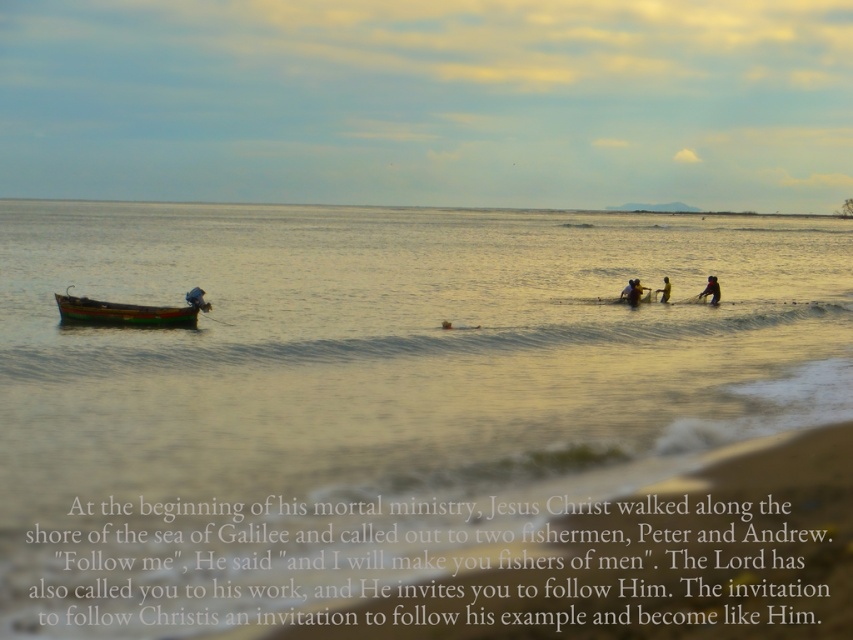
Question: Observing the image, what is the correct spatial positioning of dark blue fabric at lower right in reference to yellow fabric shirt at center?

Choices:
 (A) right
 (B) left

Answer: (A)

Question: Is yellow fabric shirt at center bigger than yellow fabric at center?

Choices:
 (A) yes
 (B) no

Answer: (A)

Question: Is yellow fabric shirt at center positioned in front of yellow fabric at center?

Choices:
 (A) yes
 (B) no

Answer: (A)

Question: Which of the following is the closest to the observer?

Choices:
 (A) yellow fabric at center
 (B) dark blue fabric at lower right
 (C) wooden boat at left
 (D) yellow fabric shirt at center

Answer: (C)

Question: Considering the real-world distances, which object is closest to the yellow fabric shirt at center?

Choices:
 (A) yellow fabric at center
 (B) wooden boat at left
 (C) smooth golden water at center
 (D) dark blue fabric at lower right

Answer: (A)

Question: Which of the following is the closest to the observer?

Choices:
 (A) (233, 323)
 (B) (660, 300)
 (C) (627, 300)

Answer: (A)